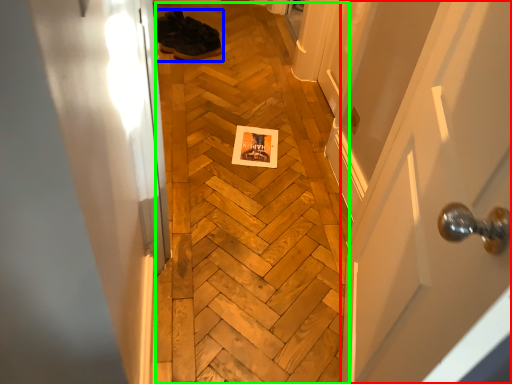
Question: Based on their relative distances, which object is nearer to door (highlighted by a red box)? Choose from footwear (highlighted by a blue box) and plywood (highlighted by a green box).

Choices:
 (A) footwear
 (B) plywood

Answer: (B)